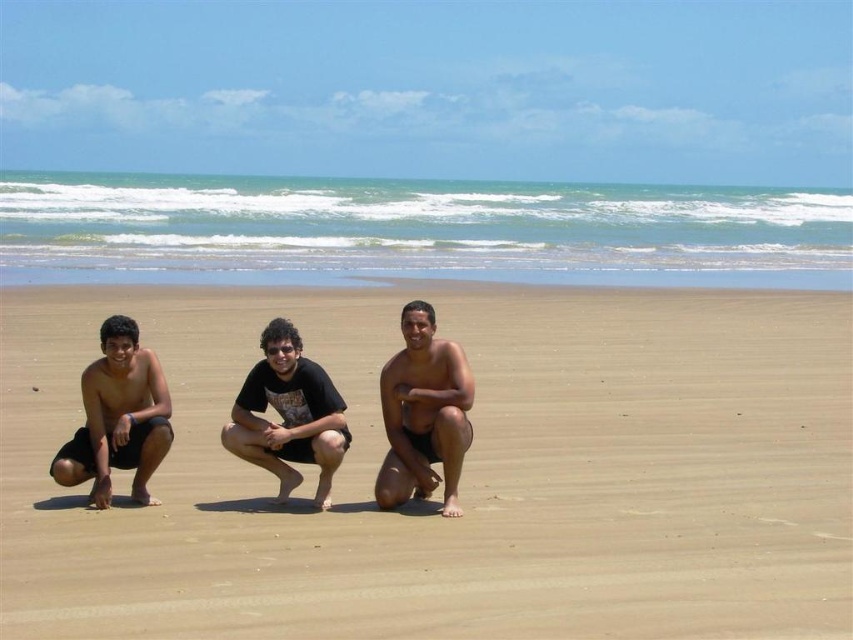
Question: Which point is closer to the camera?

Choices:
 (A) pyautogui.click(x=328, y=424)
 (B) pyautogui.click(x=589, y=486)

Answer: (A)

Question: Does black matte shorts at left come behind black matte shorts at center?

Choices:
 (A) yes
 (B) no

Answer: (B)

Question: Which object is closer to the camera taking this photo?

Choices:
 (A) black matte shorts at left
 (B) black matte shorts at center
 (C) matte black shorts at center
 (D) brown sandy beach at center

Answer: (D)

Question: Is brown sandy beach at center thinner than black matte shorts at center?

Choices:
 (A) no
 (B) yes

Answer: (A)

Question: Based on their relative distances, which object is farther from the black matte shorts at left?

Choices:
 (A) brown sandy beach at center
 (B) black matte shorts at center

Answer: (A)

Question: Can you confirm if black matte shorts at left is thinner than black matte shorts at center?

Choices:
 (A) no
 (B) yes

Answer: (B)